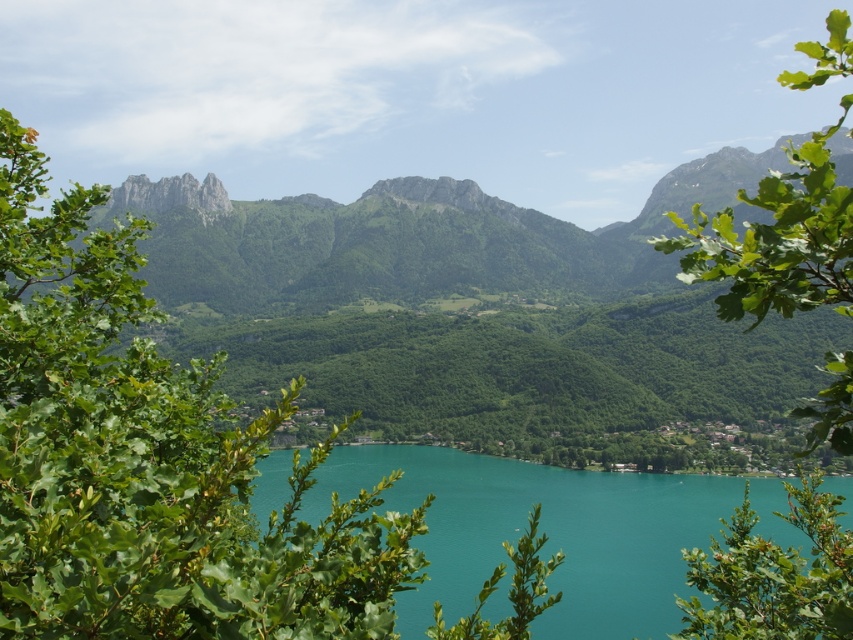
You are standing at the center of the lake in the image. Looking towards the mountains, you see a point marked at coordinates (776, 240). Which object from the scene does this point correspond to?

The point at coordinates (776, 240) corresponds to the green leafy tree at upper right.

You are standing in the middle of the scene and see the green leafy tree at upper right and the green leafy tree at lower right. Which tree is located to the right of the other?

The green leafy tree at upper right is positioned on the right side of the green leafy tree at lower right.